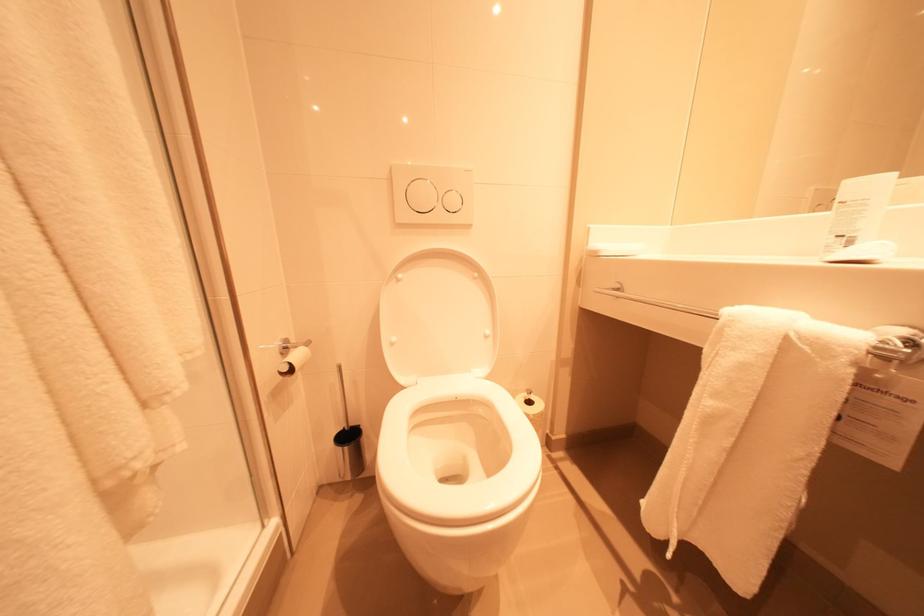
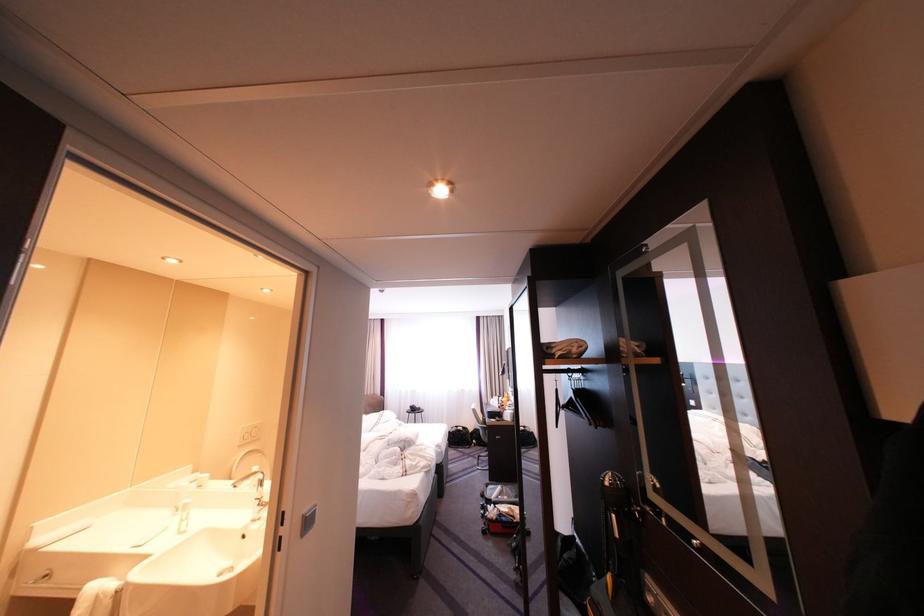
Locate, in the second image, the point that corresponds to the point at 829,191 in the first image.

(254, 429)